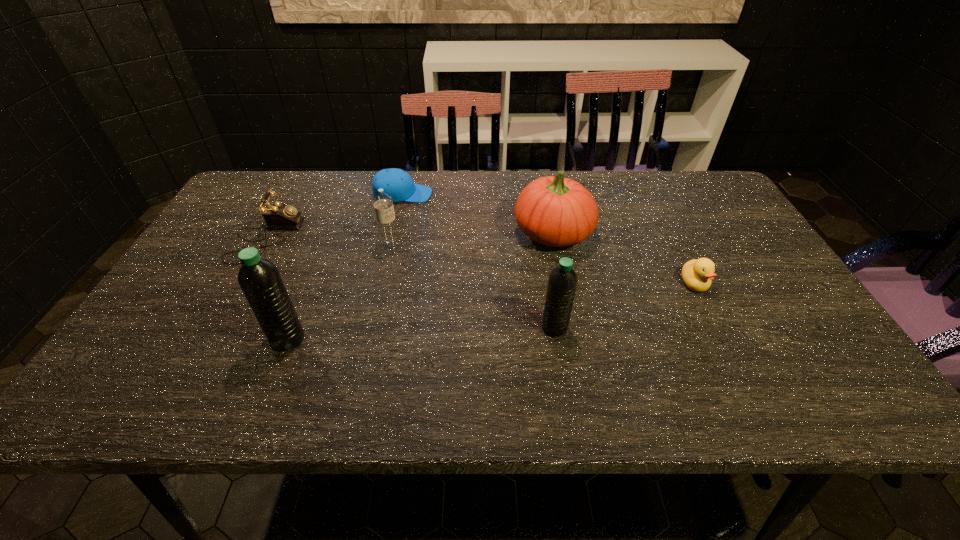
What are the coordinates of `vacant space at the near edge` in the screenshot? It's located at (401, 360).

The width and height of the screenshot is (960, 540). Identify the location of vacant area at the left edge. (231, 275).

Locate an element on the screen. vacant space at the far left corner of the desktop is located at coordinates (241, 212).

Find the location of a particular element. The height and width of the screenshot is (540, 960). vacant region at the near left corner of the desktop is located at coordinates (193, 343).

At what (x,y) coordinates should I click in order to perform the action: click on free region at the far right corner of the desktop. Please return your answer as a coordinate pair (x, y). This screenshot has height=540, width=960. Looking at the image, I should click on (710, 197).

This screenshot has height=540, width=960. Identify the location of vacant space at the near right corner of the desktop. (770, 365).

Identify the location of vacant area that lies between the fifth farthest object and the leftmost object. (480, 261).

Where is `vacant space that is in between the farthest water bottle and the rightmost water bottle`? This screenshot has height=540, width=960. vacant space that is in between the farthest water bottle and the rightmost water bottle is located at coordinates (472, 287).

The height and width of the screenshot is (540, 960). I want to click on vacant point located between the tallest water bottle and the duckling, so click(x=491, y=311).

The height and width of the screenshot is (540, 960). What are the coordinates of `free space between the tallest water bottle and the rightmost water bottle` in the screenshot? It's located at (421, 333).